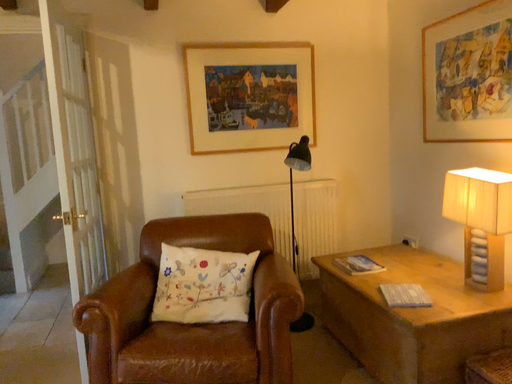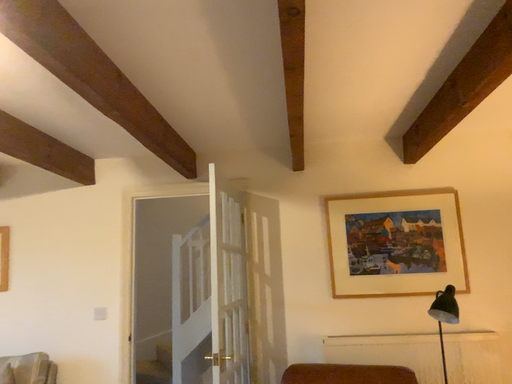
Question: How did the camera likely rotate when shooting the video?

Choices:
 (A) rotated upward
 (B) rotated downward

Answer: (A)